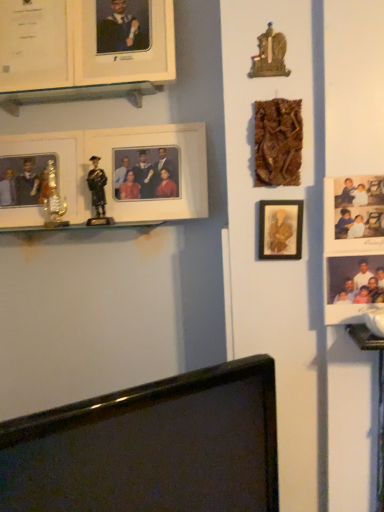
Question: Is matte gold picture frame at center-right, which ranks as the fifth picture frame in back-to-front order, not close to metallic gold trophy at left, marked as the 6th picture frame in a front-to-back arrangement?

Choices:
 (A) no
 (B) yes

Answer: (A)

Question: Does matte gold picture frame at center-right, which appears as the second picture frame when viewed from the front, have a lesser width compared to metallic gold trophy at left, marked as the 6th picture frame in a front-to-back arrangement?

Choices:
 (A) yes
 (B) no

Answer: (A)

Question: From the image's perspective, does matte gold picture frame at center-right, which ranks as the fifth picture frame in back-to-front order, appear lower than metallic gold trophy at left, marked as the 6th picture frame in a front-to-back arrangement?

Choices:
 (A) yes
 (B) no

Answer: (A)

Question: Does matte gold picture frame at center-right, which appears as the second picture frame when viewed from the front, lie in front of metallic gold trophy at left, which is counted as the 1th picture frame, starting from the back?

Choices:
 (A) no
 (B) yes

Answer: (B)

Question: Can you see matte gold picture frame at center-right, which appears as the second picture frame when viewed from the front, touching metallic gold trophy at left, marked as the 6th picture frame in a front-to-back arrangement?

Choices:
 (A) yes
 (B) no

Answer: (B)

Question: Considering the relative sizes of matte gold picture frame at center-right, which ranks as the fifth picture frame in back-to-front order, and metallic gold trophy at left, which is counted as the 1th picture frame, starting from the back, in the image provided, is matte gold picture frame at center-right, which ranks as the fifth picture frame in back-to-front order, shorter than metallic gold trophy at left, which is counted as the 1th picture frame, starting from the back,?

Choices:
 (A) no
 (B) yes

Answer: (B)

Question: Is white matte picture frame at upper left, which is counted as the 3th picture frame, starting from the back, at the right side of black glossy monitor at bottom?

Choices:
 (A) yes
 (B) no

Answer: (B)

Question: Is white matte picture frame at upper left, the fourth picture frame positioned from the front, not inside black glossy monitor at bottom?

Choices:
 (A) yes
 (B) no

Answer: (A)

Question: From a real-world perspective, is white matte picture frame at upper left, the fourth picture frame positioned from the front, over black glossy monitor at bottom?

Choices:
 (A) no
 (B) yes

Answer: (B)

Question: Is white matte picture frame at upper left, the fourth picture frame positioned from the front, positioned far away from black glossy monitor at bottom?

Choices:
 (A) no
 (B) yes

Answer: (B)

Question: Considering the relative sizes of white matte picture frame at upper left, which is counted as the 3th picture frame, starting from the back, and black glossy monitor at bottom in the image provided, is white matte picture frame at upper left, which is counted as the 3th picture frame, starting from the back, bigger than black glossy monitor at bottom?

Choices:
 (A) yes
 (B) no

Answer: (B)

Question: From the image's perspective, is white matte picture frame at upper left, the fourth picture frame positioned from the front, below black glossy monitor at bottom?

Choices:
 (A) no
 (B) yes

Answer: (A)

Question: From the image's perspective, is matte black figure at left located beneath metallic gold trophy at left, marked as the 6th picture frame in a front-to-back arrangement?

Choices:
 (A) yes
 (B) no

Answer: (A)